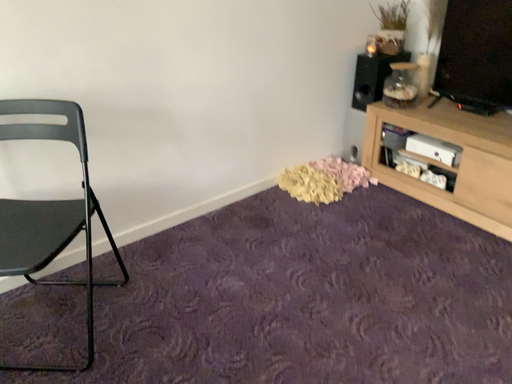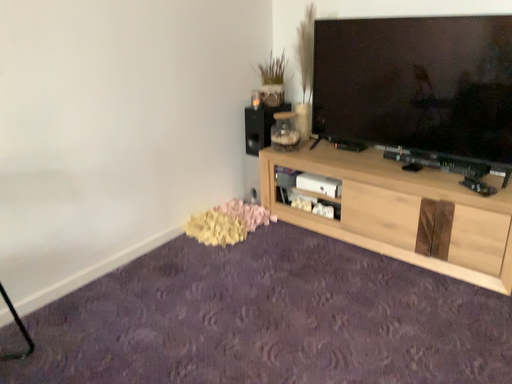
Question: How did the camera likely rotate when shooting the video?

Choices:
 (A) rotated right
 (B) rotated left

Answer: (A)